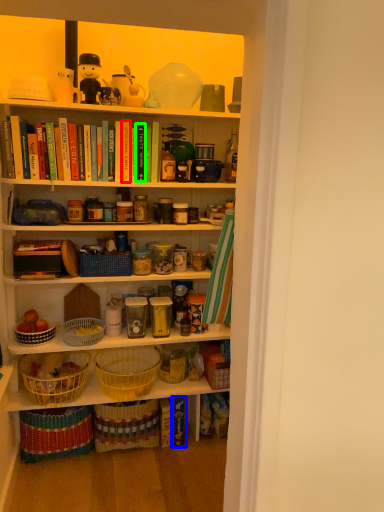
Question: Estimate the real-world distances between objects in this image. Which object is closer to book (highlighted by a red box), book (highlighted by a blue box) or book (highlighted by a green box)?

Choices:
 (A) book
 (B) book

Answer: (B)